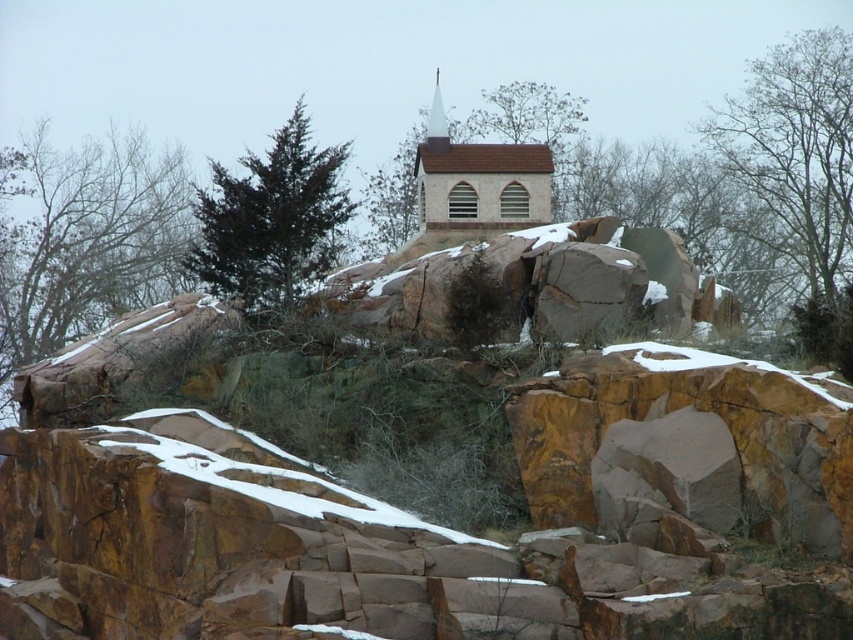
This screenshot has width=853, height=640. What do you see at coordinates (85, 240) in the screenshot?
I see `green leafy tree at upper left` at bounding box center [85, 240].

Identify the location of green leafy tree at upper left. (85, 240).

Is bare branches at upper right to the left of dark green coniferous tree at upper center from the viewer's perspective?

In fact, bare branches at upper right is to the right of dark green coniferous tree at upper center.

Between point (805, 250) and point (279, 156), which one is positioned in front?

Point (279, 156)

Does point (848, 243) lie behind point (204, 211)?

Yes.

The width and height of the screenshot is (853, 640). Identify the location of bare branches at upper right. (798, 148).

Between green leafy tree at upper left and smooth brown church steeple at center, which one is positioned lower?

green leafy tree at upper left is lower down.

Is green leafy tree at upper left to the left of smooth brown church steeple at center from the viewer's perspective?

Correct, you'll find green leafy tree at upper left to the left of smooth brown church steeple at center.

What do you see at coordinates (85, 240) in the screenshot? I see `green leafy tree at upper left` at bounding box center [85, 240].

The width and height of the screenshot is (853, 640). I want to click on green leafy tree at upper left, so coord(85,240).